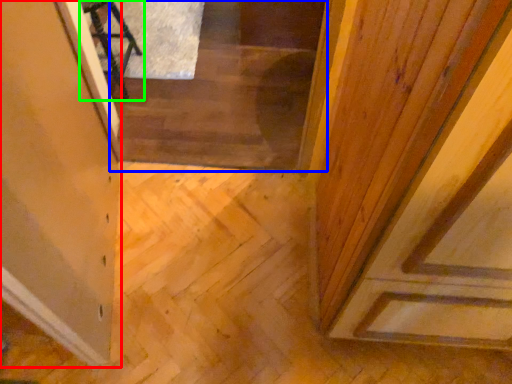
Question: Considering the real-world distances, which object is farthest from glass door (highlighted by a red box)? stairwell (highlighted by a blue box) or furniture (highlighted by a green box)?

Choices:
 (A) stairwell
 (B) furniture

Answer: (B)